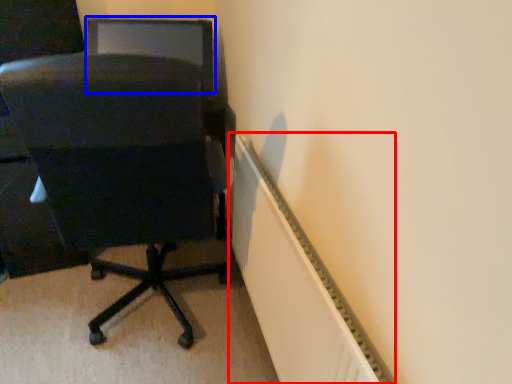
Question: Among these objects, which one is nearest to the camera, radiator (highlighted by a red box) or computer monitor (highlighted by a blue box)?

Choices:
 (A) radiator
 (B) computer monitor

Answer: (A)